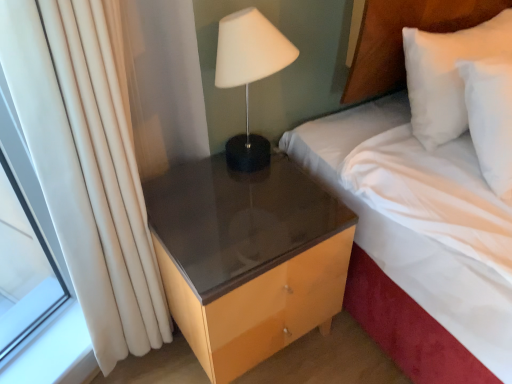
Where is `free space above glossy wood nightstand at lower right (from a real-world perspective)`? The height and width of the screenshot is (384, 512). free space above glossy wood nightstand at lower right (from a real-world perspective) is located at coordinates (234, 208).